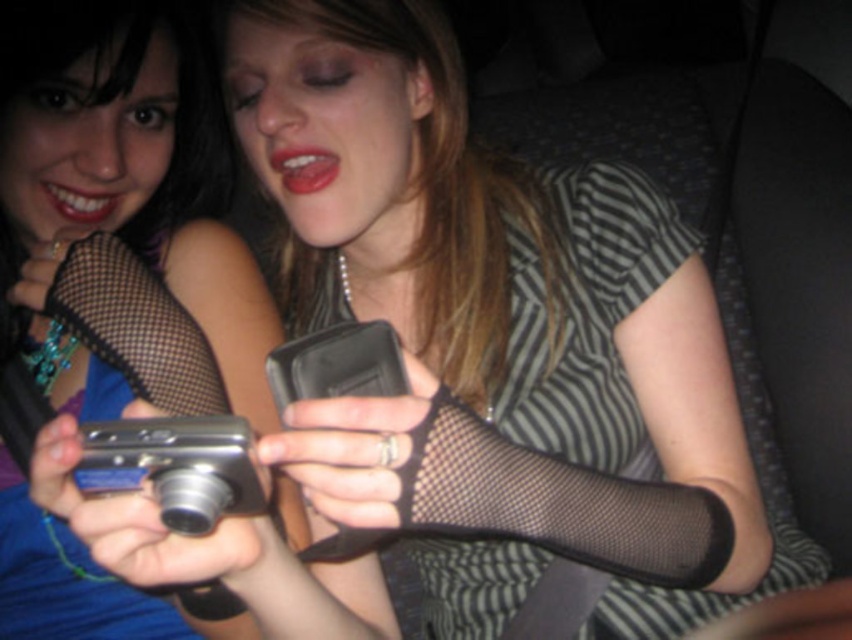
Question: Which point is closer to the camera?

Choices:
 (A) (73, 596)
 (B) (721, 500)

Answer: (B)

Question: Considering the relative positions of matte black camera at center and black mesh stocking at center in the image provided, where is matte black camera at center located with respect to black mesh stocking at center?

Choices:
 (A) above
 (B) below

Answer: (A)

Question: Which of the following is the closest to the observer?

Choices:
 (A) (401, 465)
 (B) (240, 410)

Answer: (A)

Question: Can you confirm if matte black camera at center is wider than black mesh stocking at center?

Choices:
 (A) yes
 (B) no

Answer: (A)

Question: Is matte black camera at center bigger than black mesh stocking at center?

Choices:
 (A) no
 (B) yes

Answer: (B)